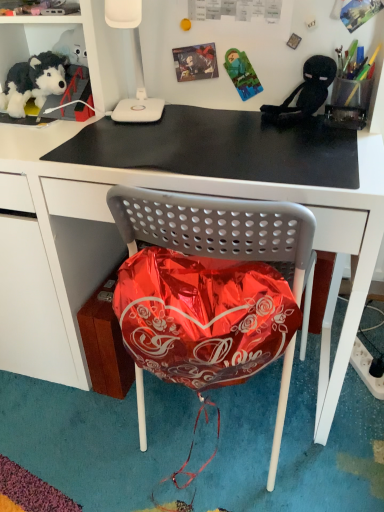
Find the location of a particular element. This screenshot has width=384, height=512. free location in front of white plastic lamp at upper center is located at coordinates (115, 140).